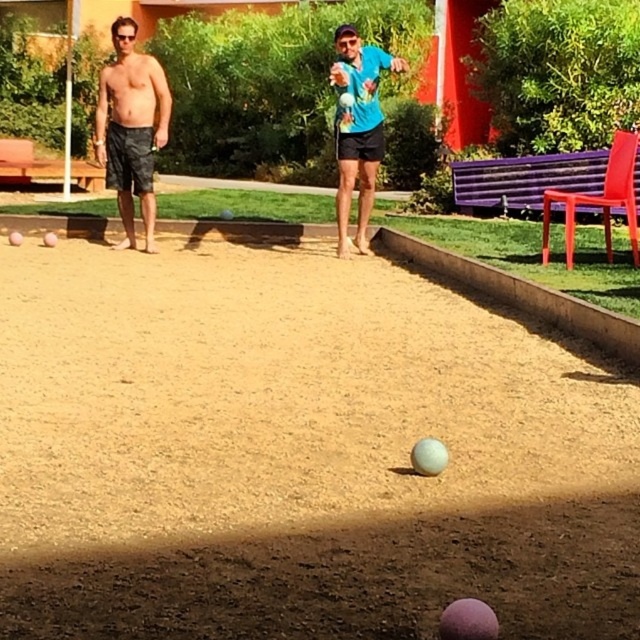
Does camouflage shorts at left appear under blue matte shirt at center?

No.

Measure the distance between point (115,163) and camera.

9.20 meters

Which is behind, point (154, 100) or point (355, 157)?

The point (154, 100) is behind.

This screenshot has height=640, width=640. Identify the location of camouflage shorts at left. (131, 128).

Is brown sandy ground at center taller than blue matte shirt at center?

No, brown sandy ground at center is not taller than blue matte shirt at center.

Does brown sandy ground at center appear on the left side of blue matte shirt at center?

Yes, brown sandy ground at center is to the left of blue matte shirt at center.

Who is more distant from viewer, (44, 518) or (339, 182)?

The point (339, 182) is behind.

Find the location of a particular element. brown sandy ground at center is located at coordinates click(298, 452).

Can you confirm if brown sandy ground at center is shorter than camouflage shorts at left?

Yes, brown sandy ground at center is shorter than camouflage shorts at left.

You are a GUI agent. You are given a task and a screenshot of the screen. Output one action in this format:
    pyautogui.click(x=<x>, y=<y>)
    Task: Click on the brown sandy ground at center
    
    Given the screenshot: What is the action you would take?
    pyautogui.click(x=298, y=452)